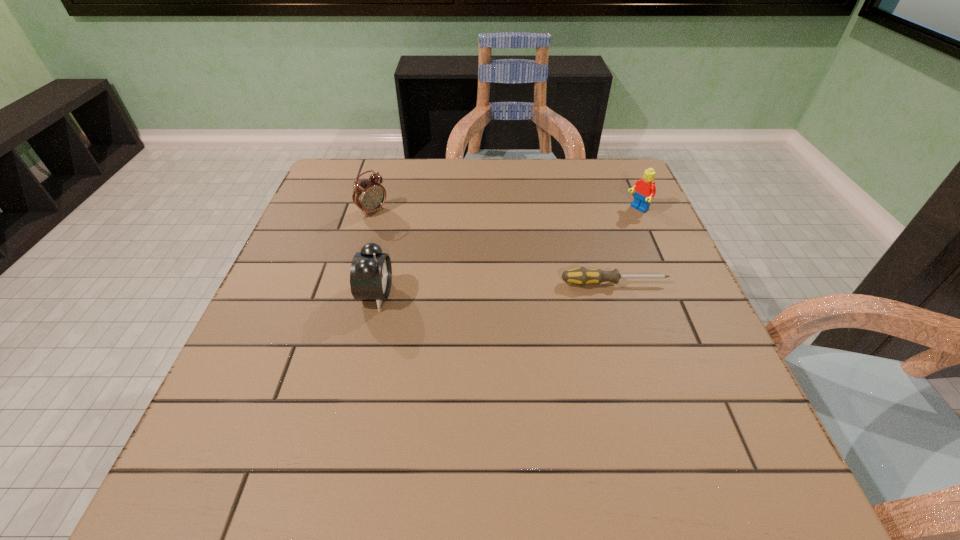
You are a GUI agent. You are given a task and a screenshot of the screen. Output one action in this format:
    pyautogui.click(x=<x>, y=<y>)
    Task: Click on the nearer alarm clock
    Image resolution: width=960 pixels, height=540 pixels.
    Given the screenshot: What is the action you would take?
    pyautogui.click(x=371, y=272)

Image resolution: width=960 pixels, height=540 pixels. I want to click on screwdriver, so click(x=581, y=276).

The image size is (960, 540). Find the location of `the farther alarm clock`. the farther alarm clock is located at coordinates (369, 195).

The width and height of the screenshot is (960, 540). I want to click on Lego, so click(645, 189).

Where is `vacant space situated 0.320m on the front side of the nearer alarm clock`? vacant space situated 0.320m on the front side of the nearer alarm clock is located at coordinates (540, 295).

You are a GUI agent. You are given a task and a screenshot of the screen. Output one action in this format:
    pyautogui.click(x=<x>, y=<y>)
    Task: Click on the free space located 0.320m on the face of the farther alarm clock
    The image size is (960, 540).
    Given the screenshot: What is the action you would take?
    pyautogui.click(x=466, y=279)

At what (x,y) coordinates should I click in order to perform the action: click on vacant space located on the face of the farther alarm clock. Please return your answer as a coordinate pair (x, y). Looking at the image, I should click on (436, 258).

What are the coordinates of `free space located 0.290m on the face of the farther alarm clock` in the screenshot? It's located at (456, 272).

Find the location of a particular element. free region located on the face of the Lego is located at coordinates (618, 221).

Find the location of `blank space located on the face of the Lego`. blank space located on the face of the Lego is located at coordinates (532, 274).